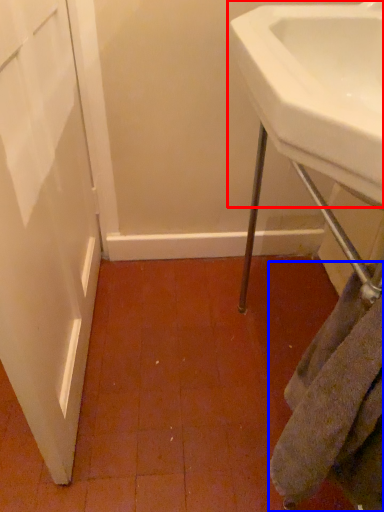
Question: Which of the following is the closest to the observer, sink (highlighted by a red box) or towel/napkin (highlighted by a blue box)?

Choices:
 (A) sink
 (B) towel/napkin

Answer: (A)